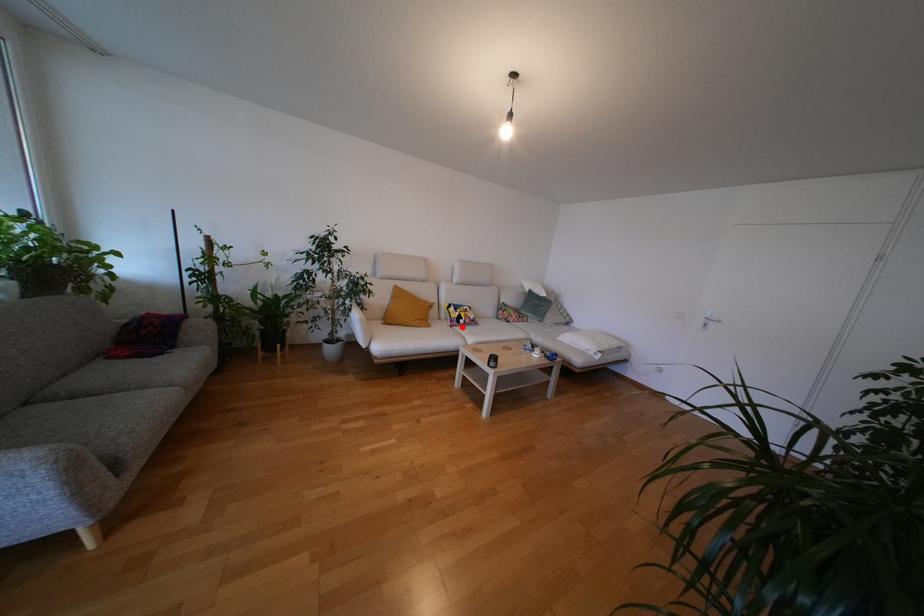
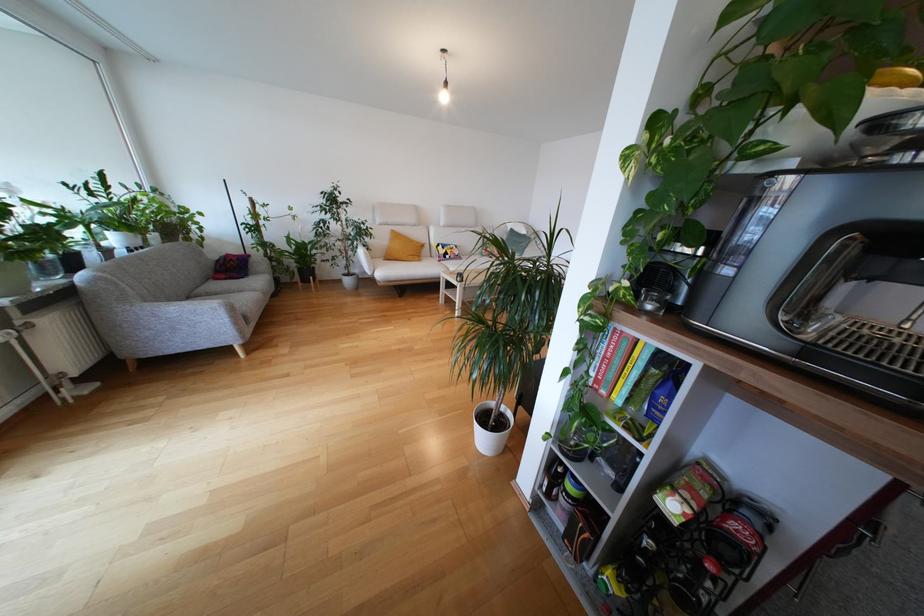
Where in the second image is the point corresponding to the highlighted location from the first image?

(448, 262)